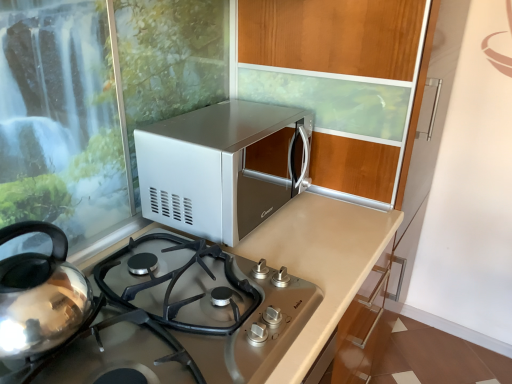
Question: From a real-world perspective, is satin silver microwave at upper center positioned above or below satin silver gas stove at center?

Choices:
 (A) above
 (B) below

Answer: (A)

Question: Is satin silver microwave at upper center inside or outside of satin silver gas stove at center?

Choices:
 (A) inside
 (B) outside

Answer: (B)

Question: Looking at their shapes, would you say satin silver microwave at upper center is wider or thinner than satin silver gas stove at center?

Choices:
 (A) thin
 (B) wide

Answer: (A)

Question: From a real-world perspective, is satin silver gas stove at center positioned above or below satin silver microwave at upper center?

Choices:
 (A) above
 (B) below

Answer: (B)

Question: Is satin silver gas stove at center in front of or behind satin silver microwave at upper center in the image?

Choices:
 (A) front
 (B) behind

Answer: (A)

Question: Would you say satin silver gas stove at center is inside or outside satin silver microwave at upper center?

Choices:
 (A) inside
 (B) outside

Answer: (B)

Question: Is point (138, 221) closer or farther from the camera than point (159, 130)?

Choices:
 (A) closer
 (B) farther

Answer: (B)